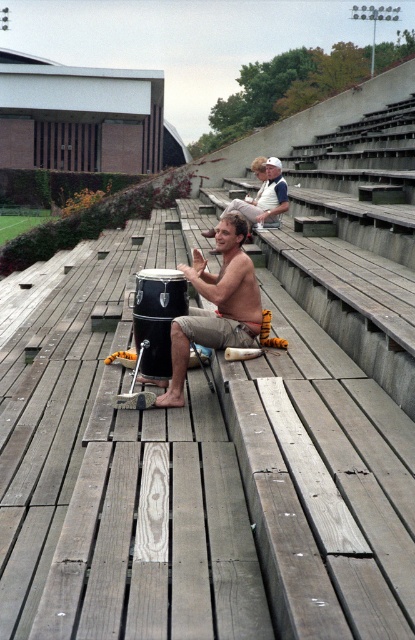
Question: Is shiny black drum at center smaller than shiny silver drum at center?

Choices:
 (A) yes
 (B) no

Answer: (A)

Question: Among these points, which one is nearest to the camera?

Choices:
 (A) (282, 177)
 (B) (219, 292)

Answer: (B)

Question: Which of the following is the closest to the observer?

Choices:
 (A) shiny black drum at center
 (B) shiny silver drum at center

Answer: (A)

Question: Does shiny black drum at center have a greater width compared to shiny silver drum at center?

Choices:
 (A) no
 (B) yes

Answer: (A)

Question: Can you confirm if shiny black drum at center is positioned below shiny silver drum at center?

Choices:
 (A) no
 (B) yes

Answer: (B)